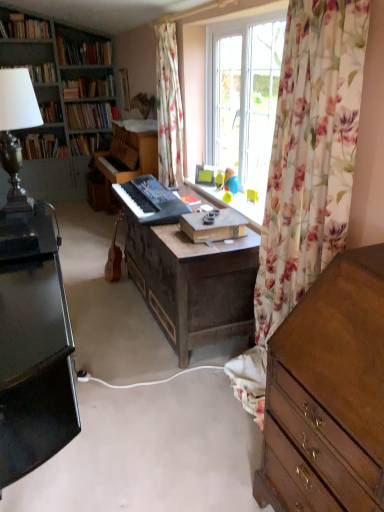
Locate an element on the screen. vacant region to the left of floral fabric curtain at right, placed as the second curtain when sorted from left to right is located at coordinates (190, 404).